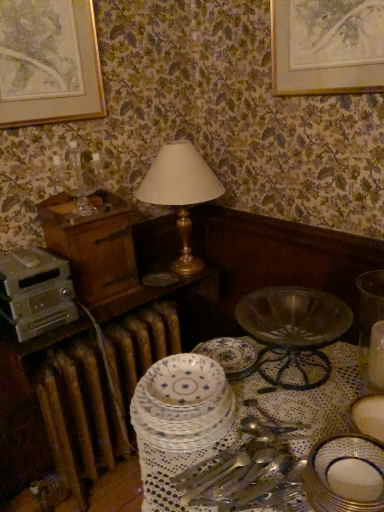
Question: From the image's perspective, is metallic silver appliance at left above or below clear glass candle holder at upper left?

Choices:
 (A) below
 (B) above

Answer: (A)

Question: Relative to clear glass candle holder at upper left, is metallic silver appliance at left in front or behind?

Choices:
 (A) front
 (B) behind

Answer: (A)

Question: Estimate the real-world distances between objects in this image. Which object is closer to the translucent glass bowl at lower right?

Choices:
 (A) gold metallic table lamp at center
 (B) clear glass candle holder at upper left
 (C) blue floral plate at center, which is the third plate in front-to-back order
 (D) porcelain plate at center, which is counted as the second plate, starting from the front
 (E) brown metallic radiator at lower left

Answer: (C)

Question: Based on their relative distances, which object is nearer to the gold-framed artwork at upper left?

Choices:
 (A) gold metallic table lamp at center
 (B) metallic silver appliance at left
 (C) clear glass candle holder at upper left
 (D) porcelain plate at center, the 1th plate positioned from the left
 (E) translucent glass bowl at lower right

Answer: (C)